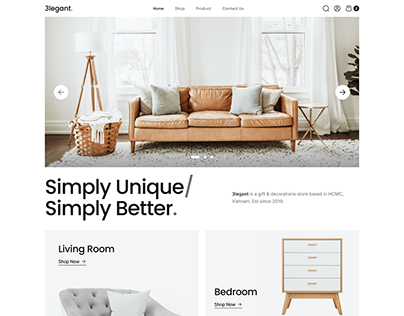
You are a GUI agent. You are given a task and a screenshot of the screen. Output one action in this format:
    pyautogui.click(x=<x>, y=<y>)
    Task: Click on the couch/sofa
    This screenshot has width=404, height=316.
    Given the screenshot: What is the action you would take?
    pyautogui.click(x=210, y=119)